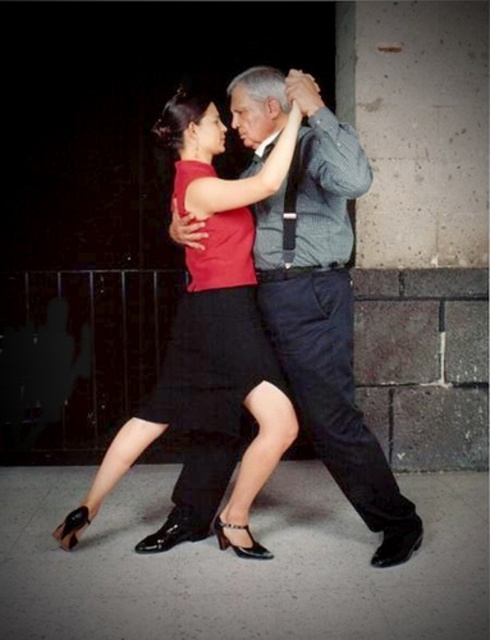
Is point (255, 394) behind point (229, 284)?

No, it is not.

Does matte red blouse at center come behind matte red dress at center?

No, it is in front of matte red dress at center.

Who is more distant from viewer, (103, 467) or (250, 225)?

The point (250, 225) is more distant.

This screenshot has height=640, width=490. Find the location of `matte red blouse at center`. matte red blouse at center is located at coordinates (211, 323).

Which of these two, matte gray shirt at center or matte red dress at center, stands shorter?

matte red dress at center

Describe the element at coordinates (320, 296) in the screenshot. The image size is (490, 640). I see `matte gray shirt at center` at that location.

This screenshot has height=640, width=490. Identify the location of matte gray shirt at center. (320, 296).

Describe the element at coordinates (320, 296) in the screenshot. The height and width of the screenshot is (640, 490). I see `matte gray shirt at center` at that location.

Does matte gray shirt at center appear on the right side of matte red blouse at center?

Yes, matte gray shirt at center is to the right of matte red blouse at center.

Image resolution: width=490 pixels, height=640 pixels. In order to click on matte gray shirt at center in this screenshot , I will do `click(320, 296)`.